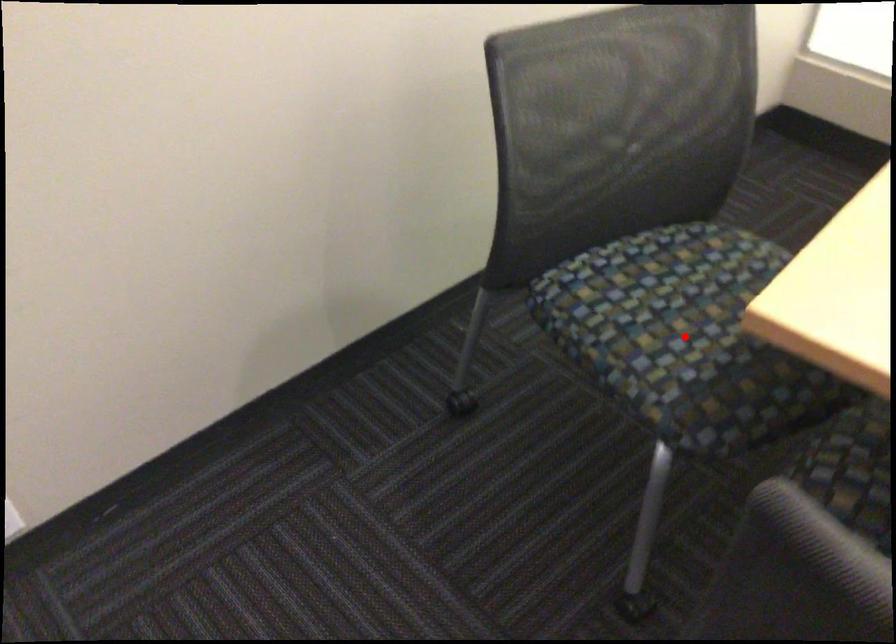
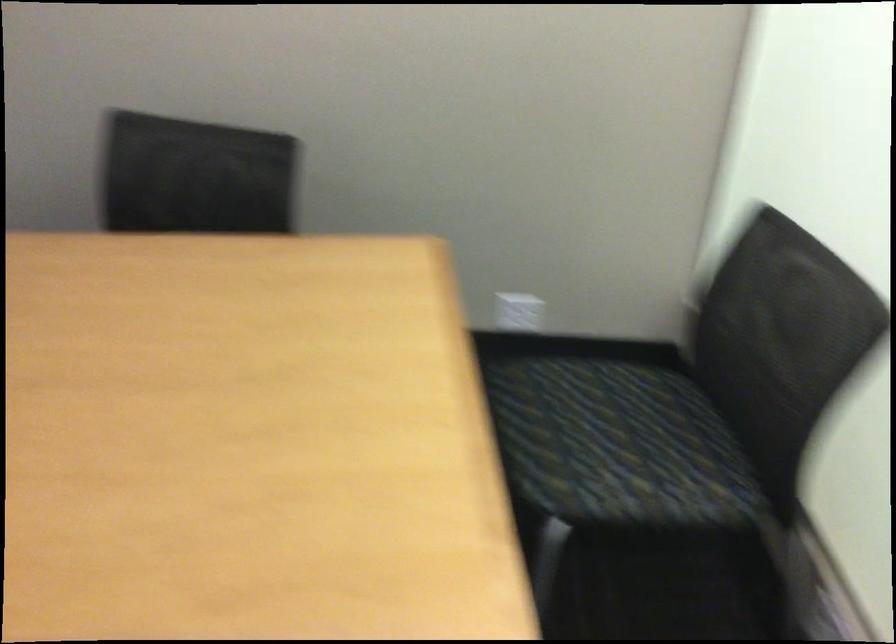
Question: I am providing you with two images of the same scene from different viewpoints. A red point is marked on the first image. At the location where the point appears in image 1, is it still visible in image 2?

Choices:
 (A) Yes
 (B) No

Answer: (B)